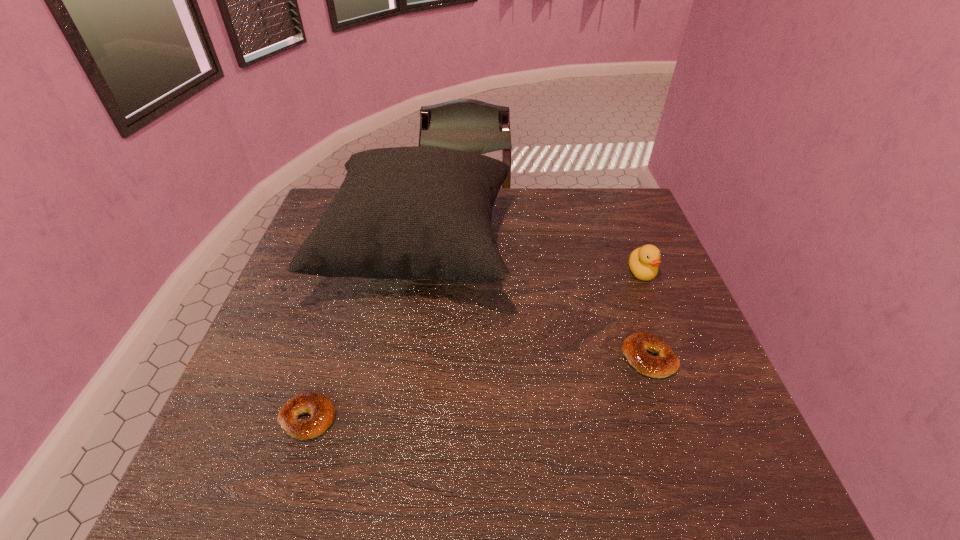
At what (x,y) coordinates should I click in order to perform the action: click on blank region between the nearest object and the farther bagel. Please return your answer as a coordinate pair (x, y). The image size is (960, 540). Looking at the image, I should click on (479, 388).

Locate which object is the closest to the second tallest object. Please provide its 2D coordinates. Your answer should be formatted as a tuple, i.e. [(x, y)], where the tuple contains the x and y coordinates of a point satisfying the conditions above.

[(635, 346)]

Where is `object that stands as the closest to the duck`? The image size is (960, 540). object that stands as the closest to the duck is located at coordinates (635, 346).